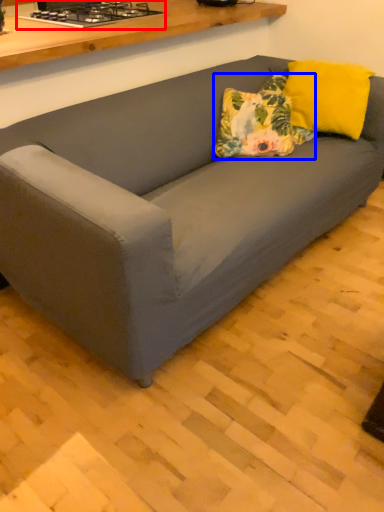
Question: Which point is closer to the camera, stove (highlighted by a red box) or throw pillow (highlighted by a blue box)?

Choices:
 (A) stove
 (B) throw pillow

Answer: (B)